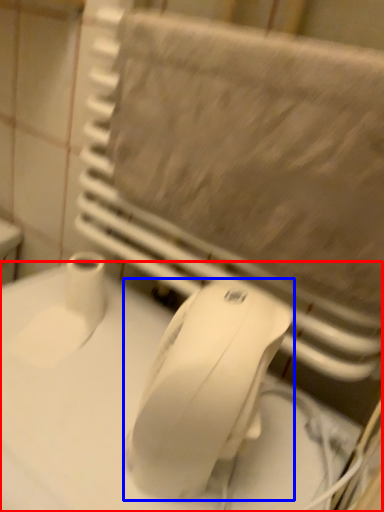
Question: Which of the following is the farthest to the observer, counter top (highlighted by a red box) or mouse (highlighted by a blue box)?

Choices:
 (A) counter top
 (B) mouse

Answer: (B)